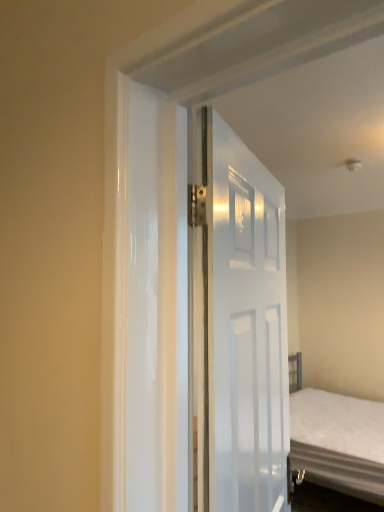
Question: Is white fabric bed at center wider than white glossy door at center?

Choices:
 (A) no
 (B) yes

Answer: (B)

Question: Does white fabric bed at center have a lesser height compared to white glossy door at center?

Choices:
 (A) no
 (B) yes

Answer: (B)

Question: Is white fabric bed at center bigger than white glossy door at center?

Choices:
 (A) yes
 (B) no

Answer: (A)

Question: From the image's perspective, is white fabric bed at center above white glossy door at center?

Choices:
 (A) no
 (B) yes

Answer: (A)

Question: Is white glossy door at center completely or partially inside white fabric bed at center?

Choices:
 (A) yes
 (B) no

Answer: (B)

Question: From a real-world perspective, is white fabric bed at center on top of white glossy door at center?

Choices:
 (A) no
 (B) yes

Answer: (A)

Question: From a real-world perspective, is white glossy door at center over white fabric bed at center?

Choices:
 (A) no
 (B) yes

Answer: (B)

Question: Is white glossy door at center to the left of white fabric bed at center from the viewer's perspective?

Choices:
 (A) yes
 (B) no

Answer: (A)

Question: Could you tell me if white glossy door at center is turned towards white fabric bed at center?

Choices:
 (A) no
 (B) yes

Answer: (A)

Question: Can you confirm if white glossy door at center is positioned to the right of white fabric bed at center?

Choices:
 (A) yes
 (B) no

Answer: (B)

Question: Is white glossy door at center facing away from white fabric bed at center?

Choices:
 (A) yes
 (B) no

Answer: (B)

Question: Considering the relative sizes of white glossy door at center and white fabric bed at center in the image provided, is white glossy door at center thinner than white fabric bed at center?

Choices:
 (A) no
 (B) yes

Answer: (B)

Question: Looking at the image, does white glossy door at center seem bigger or smaller compared to white fabric bed at center?

Choices:
 (A) big
 (B) small

Answer: (B)